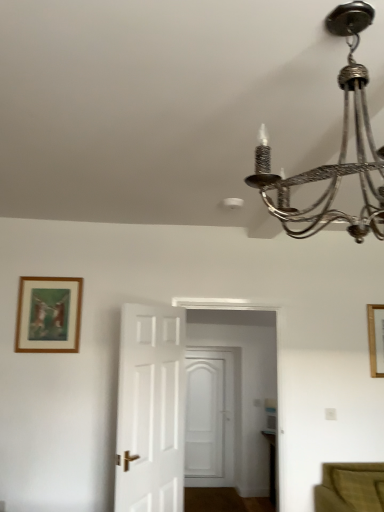
Question: Does point (372, 373) appear closer or farther from the camera than point (231, 480)?

Choices:
 (A) farther
 (B) closer

Answer: (B)

Question: Considering the positions of wooden picture frame at upper right, which is counted as the second picture frame, starting from the left, and white wooden door at center, marked as the 2th door in a front-to-back arrangement, in the image, is wooden picture frame at upper right, which is counted as the second picture frame, starting from the left, bigger or smaller than white wooden door at center, marked as the 2th door in a front-to-back arrangement,?

Choices:
 (A) big
 (B) small

Answer: (B)

Question: Estimate the real-world distances between objects in this image. Which object is closer to the brown wooden picture frame at upper left, which is the 1th picture frame in front-to-back order?

Choices:
 (A) white wooden door at center, marked as the 2th door in a front-to-back arrangement
 (B) wooden picture frame at upper right, which ranks as the 1th picture frame in right-to-left order
 (C) metallic chandelier at upper right
 (D) white wooden door at center, which appears as the first door when viewed from the front

Answer: (D)

Question: Which object is the closest to the white wooden door at center, marked as the 2th door in a front-to-back arrangement?

Choices:
 (A) metallic chandelier at upper right
 (B) wooden picture frame at upper right, which ranks as the 1th picture frame in right-to-left order
 (C) white wooden door at center, which appears as the first door when viewed from the front
 (D) brown wooden picture frame at upper left, which ranks as the second picture frame in back-to-front order

Answer: (C)